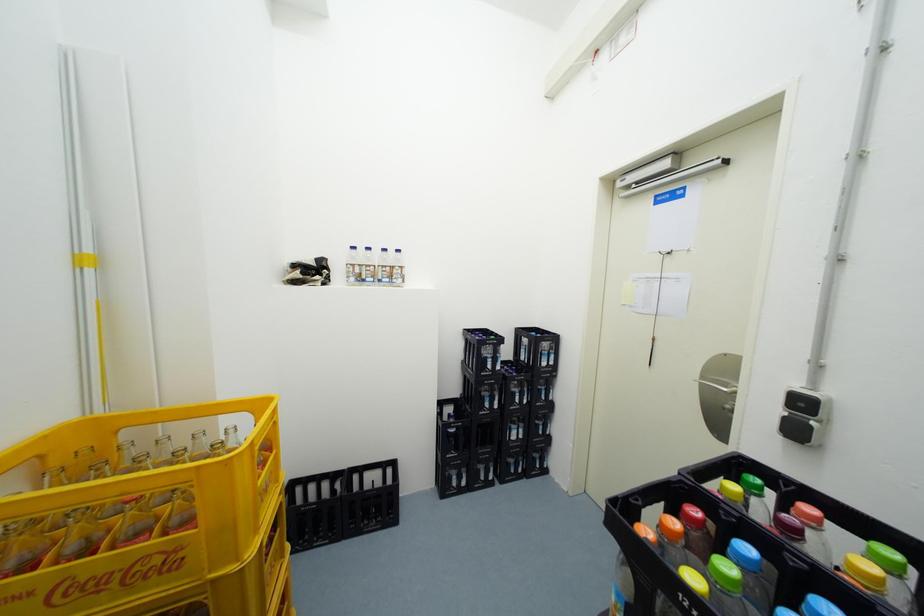
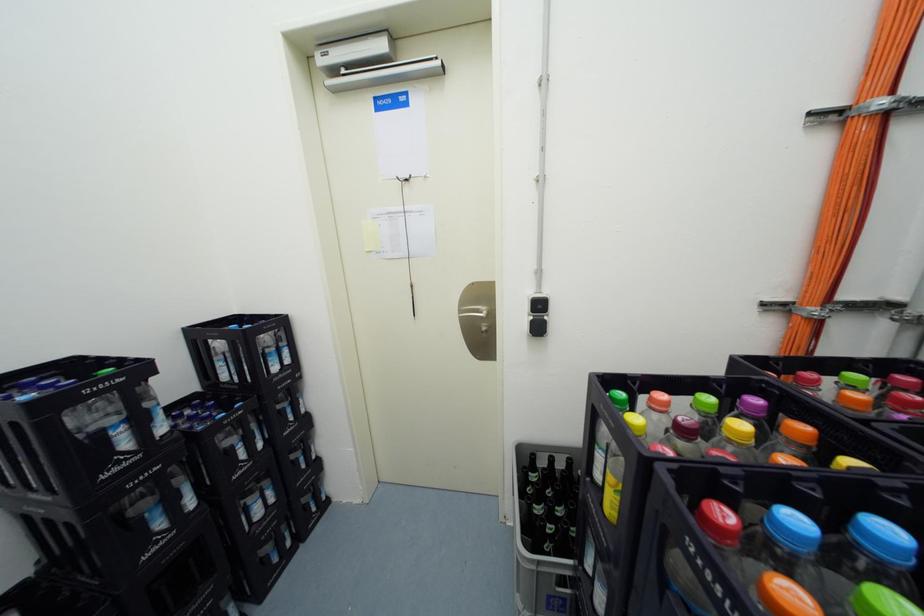
Question: The camera is either moving clockwise (left) or counter-clockwise (right) around the object. The first image is from the beginning of the video and the second image is from the end. Is the camera moving left or right when shooting the video?

Choices:
 (A) Left
 (B) Right

Answer: (A)